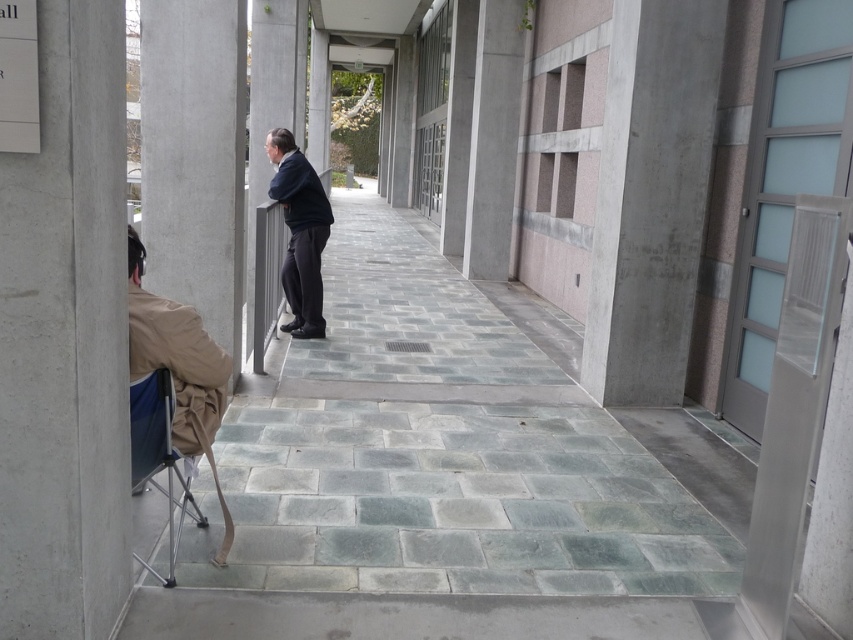
From the picture: You are a maintenance worker needing to place a new tool box between the gray concrete pillar at left and the blue fabric folding chair at lower left. Given that the tool box requires 2 square feet of space, can you determine if there is enough space between them?

The gray concrete pillar at left is larger in size than the blue fabric folding chair at lower left, but the exact distance between them isn not specified. Without knowing the distance, it is impossible to determine if there is enough space for the tool box requiring 2 square feet.